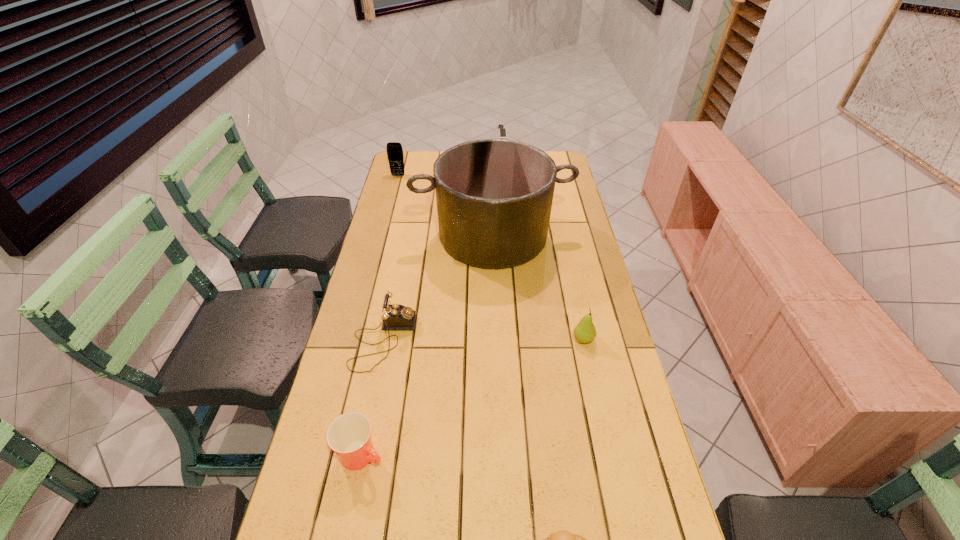
Where is `the tallest object`? the tallest object is located at coordinates (494, 197).

Where is `pan`? The image size is (960, 540). pan is located at coordinates (494, 197).

Find the location of a particular element. camcorder is located at coordinates (502, 131).

Find the location of a particular element. This screenshot has width=960, height=540. cellular telephone is located at coordinates (395, 156).

You are a GUI agent. You are given a task and a screenshot of the screen. Output one action in this format:
    pyautogui.click(x=<x>, y=<y>)
    Task: Click on the pear
    The height and width of the screenshot is (540, 960).
    Given the screenshot: What is the action you would take?
    pyautogui.click(x=585, y=332)

Image resolution: width=960 pixels, height=540 pixels. I want to click on cup, so click(x=349, y=435).

Locate an element on the screen. The image size is (960, 540). telephone is located at coordinates (395, 317).

Where is `vacant space situated on the front of the tallest object`? vacant space situated on the front of the tallest object is located at coordinates (496, 349).

This screenshot has height=540, width=960. What are the coordinates of `free space located on the recording direction of the camcorder` in the screenshot? It's located at (493, 202).

Locate an element on the screen. vacant region located 0.120m on the screen of the cellular telephone is located at coordinates (394, 192).